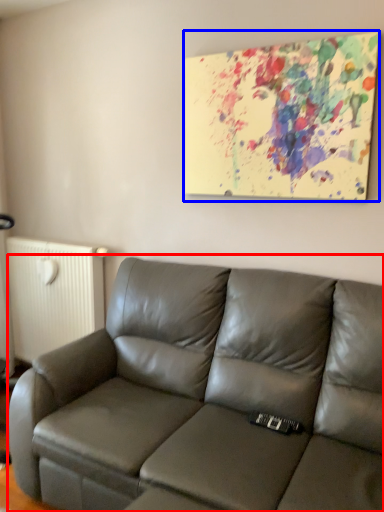
Question: Among these objects, which one is nearest to the camera, studio couch (highlighted by a red box) or picture frame (highlighted by a blue box)?

Choices:
 (A) studio couch
 (B) picture frame

Answer: (A)